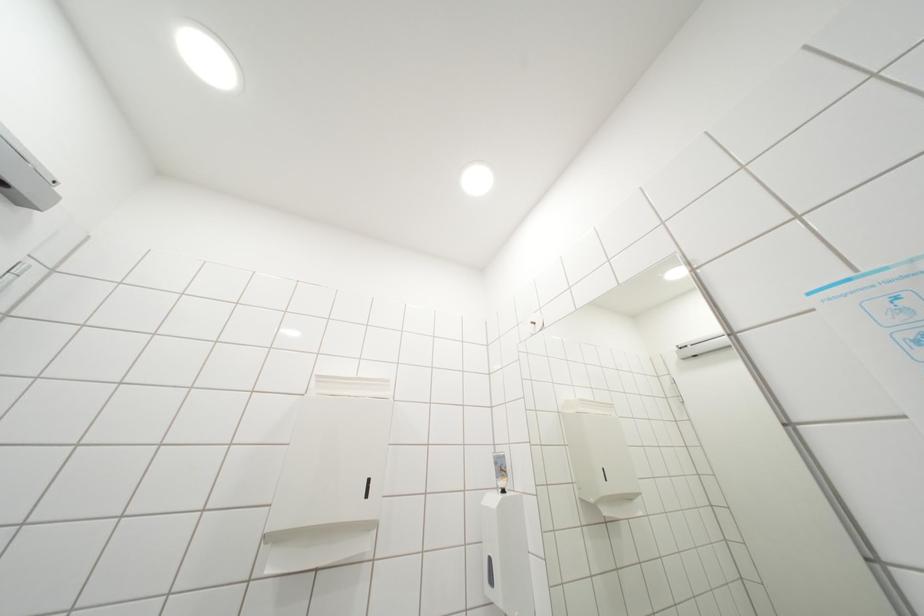
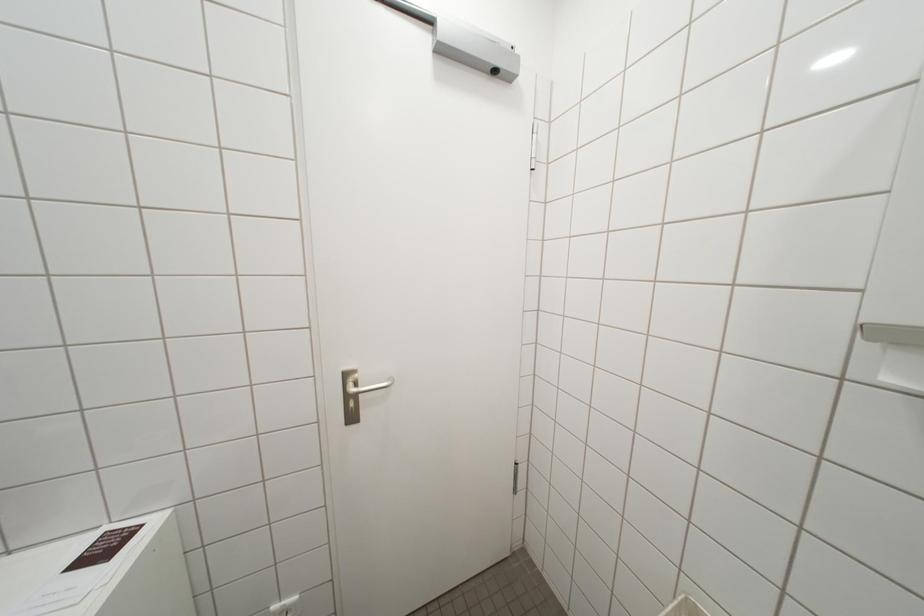
Question: How did the camera likely rotate?

Choices:
 (A) Left
 (B) Right
 (C) Up
 (D) Down

Answer: (A)